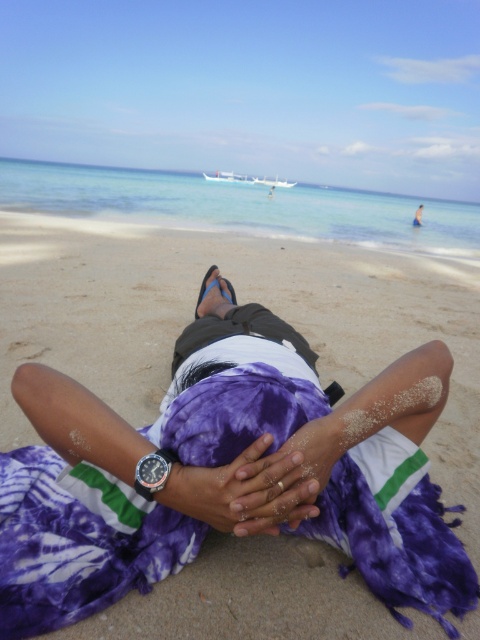
Question: Which object is the farthest from the purple fabric hands at center?

Choices:
 (A) purple fabric at center
 (B) purple tie-dye blanket at center

Answer: (A)

Question: Which is farther from the purple tie-dye blanket at center?

Choices:
 (A) purple fabric at center
 (B) purple fabric hands at center

Answer: (A)

Question: Can you confirm if purple fabric at center is bigger than purple tie-dye blanket at center?

Choices:
 (A) yes
 (B) no

Answer: (B)

Question: Considering the relative positions of purple fabric at center and purple fabric hands at center in the image provided, where is purple fabric at center located with respect to purple fabric hands at center?

Choices:
 (A) above
 (B) below

Answer: (B)

Question: Can you confirm if purple tie-dye blanket at center is positioned to the left of purple fabric hands at center?

Choices:
 (A) yes
 (B) no

Answer: (A)

Question: Which point is farther from the camera taking this photo?

Choices:
 (A) (476, 540)
 (B) (8, 554)
 (C) (305, 484)

Answer: (A)